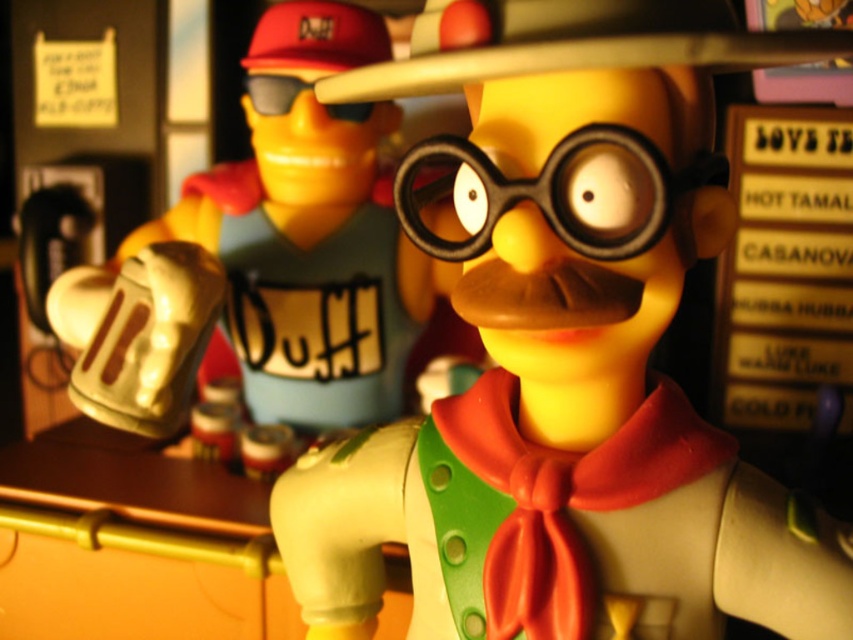
What are the coordinates of the matte plastic beer mug at upper left?

The coordinates of the matte plastic beer mug at upper left are at point (x=563, y=360).